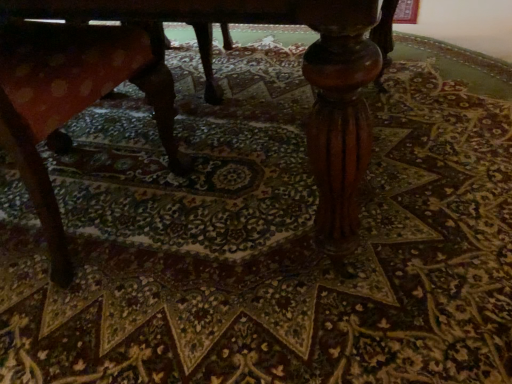
Question: Can we say wooden table at center lies outside wooden textured rocking chair at left?

Choices:
 (A) yes
 (B) no

Answer: (A)

Question: Is wooden table at center positioned with its back to wooden textured rocking chair at left?

Choices:
 (A) no
 (B) yes

Answer: (B)

Question: Is wooden table at center not near wooden textured rocking chair at left?

Choices:
 (A) no
 (B) yes

Answer: (A)

Question: Is wooden table at center next to wooden textured rocking chair at left?

Choices:
 (A) no
 (B) yes

Answer: (A)

Question: Is wooden textured rocking chair at left surrounded by wooden table at center?

Choices:
 (A) yes
 (B) no

Answer: (A)

Question: Considering the relative positions of wooden table at center and wooden textured rocking chair at left in the image provided, is wooden table at center behind wooden textured rocking chair at left?

Choices:
 (A) yes
 (B) no

Answer: (B)

Question: Can you confirm if wooden textured rocking chair at left is taller than wooden table at center?

Choices:
 (A) yes
 (B) no

Answer: (B)

Question: Is wooden table at center surrounded by wooden textured rocking chair at left?

Choices:
 (A) yes
 (B) no

Answer: (B)

Question: Can you confirm if wooden textured rocking chair at left is wider than wooden table at center?

Choices:
 (A) yes
 (B) no

Answer: (B)

Question: Could you tell me if wooden textured rocking chair at left is facing wooden table at center?

Choices:
 (A) yes
 (B) no

Answer: (A)

Question: Considering the relative sizes of wooden textured rocking chair at left and wooden table at center in the image provided, is wooden textured rocking chair at left thinner than wooden table at center?

Choices:
 (A) no
 (B) yes

Answer: (B)

Question: Can you confirm if wooden textured rocking chair at left is shorter than wooden table at center?

Choices:
 (A) yes
 (B) no

Answer: (A)

Question: Considering the positions of point (65, 48) and point (44, 14), is point (65, 48) closer or farther from the camera than point (44, 14)?

Choices:
 (A) farther
 (B) closer

Answer: (A)